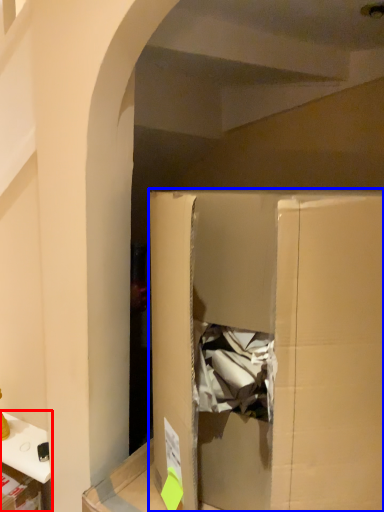
Question: Which object appears farthest to the camera in this image, furniture (highlighted by a red box) or cardboard box (highlighted by a blue box)?

Choices:
 (A) furniture
 (B) cardboard box

Answer: (A)